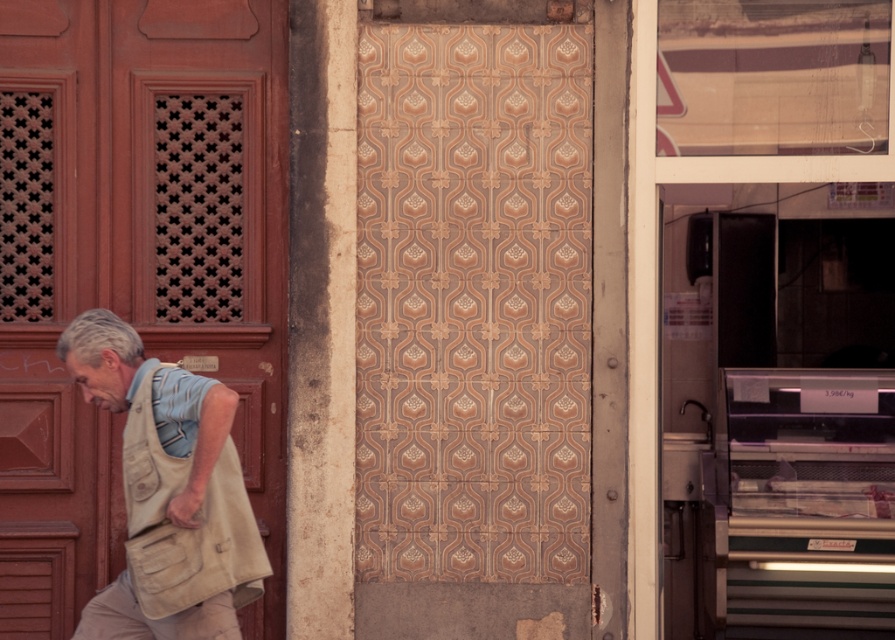
Question: Which object appears farthest from the camera in this image?

Choices:
 (A) matte red door at center
 (B) beige canvas bag at left

Answer: (A)

Question: Can you confirm if matte red door at center is smaller than beige canvas bag at left?

Choices:
 (A) yes
 (B) no

Answer: (B)

Question: Can you confirm if matte red door at center is thinner than beige canvas bag at left?

Choices:
 (A) no
 (B) yes

Answer: (A)

Question: Which object appears closest to the camera in this image?

Choices:
 (A) beige canvas bag at left
 (B) matte red door at center

Answer: (A)

Question: Does matte red door at center appear on the right side of beige canvas bag at left?

Choices:
 (A) yes
 (B) no

Answer: (B)